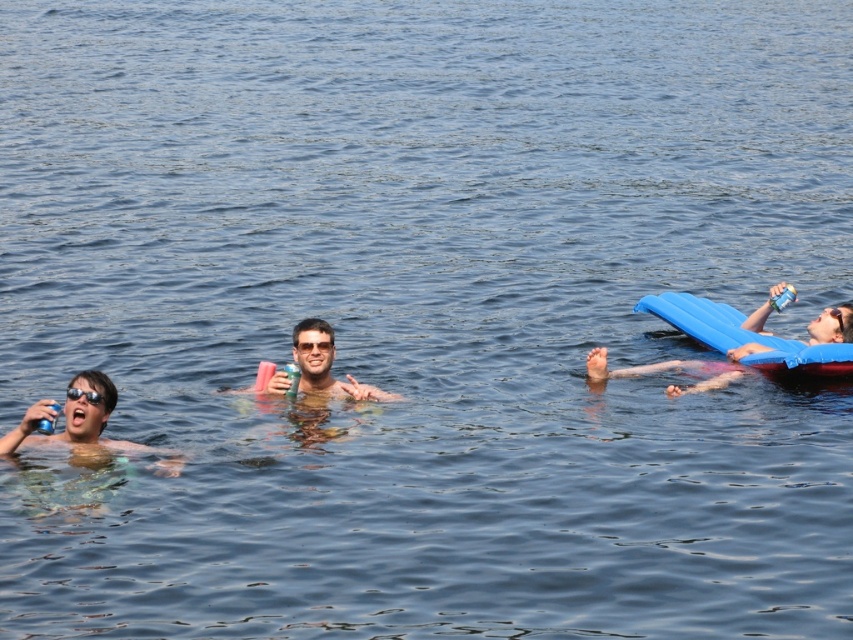
Question: Can you confirm if blue foam mattress at right is positioned below matte plastic can at center?

Choices:
 (A) yes
 (B) no

Answer: (B)

Question: Among these objects, which one is farthest from the camera?

Choices:
 (A) matte plastic can at center
 (B) black plastic goggles at upper left

Answer: (A)

Question: Considering the relative positions of blue foam mattress at right and black plastic goggles at upper left in the image provided, where is blue foam mattress at right located with respect to black plastic goggles at upper left?

Choices:
 (A) above
 (B) below

Answer: (A)

Question: Which point is farther from the camera taking this photo?

Choices:
 (A) (724, 337)
 (B) (271, 378)

Answer: (A)

Question: Estimate the real-world distances between objects in this image. Which object is farther from the black plastic goggles at upper left?

Choices:
 (A) blue foam mattress at right
 (B) matte plastic can at center

Answer: (A)

Question: Is blue foam mattress at right closer to camera compared to matte plastic can at center?

Choices:
 (A) no
 (B) yes

Answer: (A)